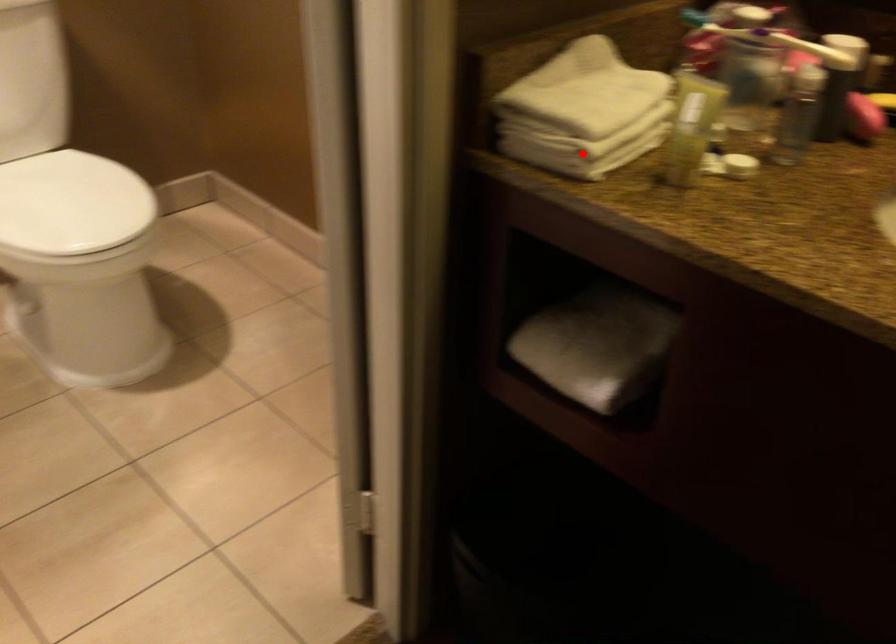
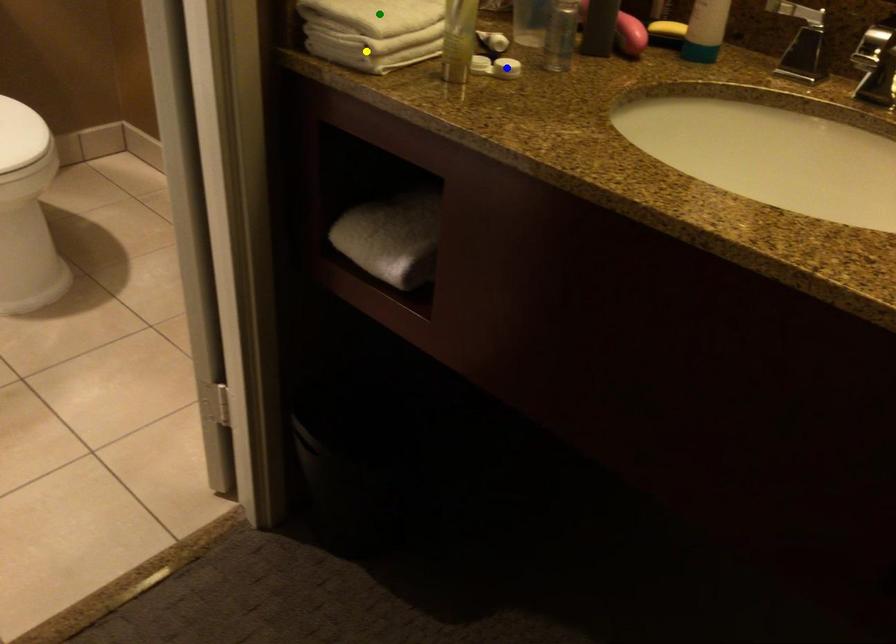
Question: I am providing you with two images of the same scene from different viewpoints. A red point is marked on the first image. You are given multiple points on the second image. Which mark in image 2 goes with the point in image 1?

Choices:
 (A) yellow point
 (B) green point
 (C) blue point

Answer: (A)